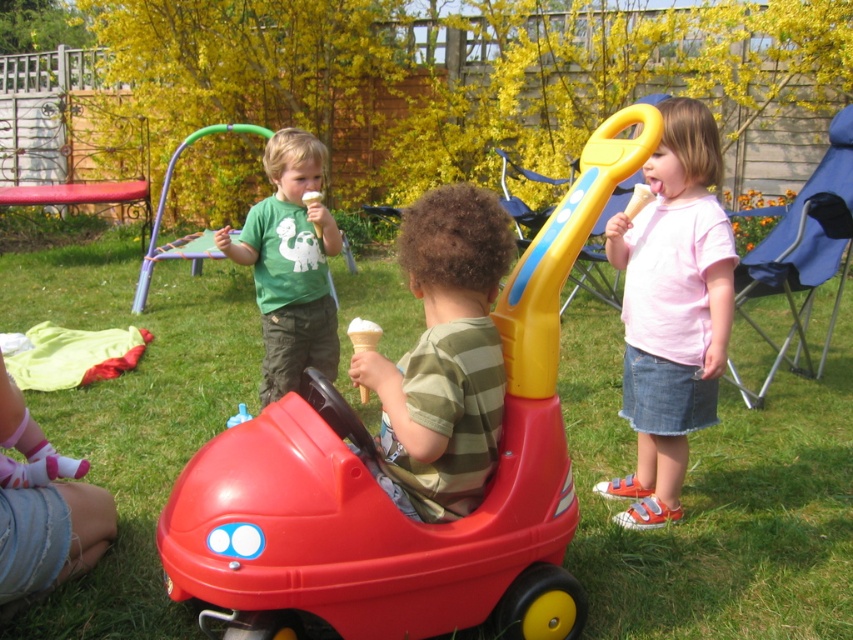
Question: Which object is farther from the camera taking this photo?

Choices:
 (A) red plastic toy car at center
 (B) striped cotton shirt at center
 (C) pink cotton shirt at upper right
 (D) vanilla ice cream in waffle cone at center

Answer: (C)

Question: Does red plastic toy car at center appear under striped cotton shirt at center?

Choices:
 (A) yes
 (B) no

Answer: (A)

Question: Is striped cotton shirt at center further to the viewer compared to matte green t-shirt at upper center?

Choices:
 (A) no
 (B) yes

Answer: (A)

Question: Which point is farther to the camera?

Choices:
 (A) vanilla ice cream in waffle cone at center
 (B) striped cotton shirt at center

Answer: (A)

Question: Considering the relative positions of red plastic toy car at center and pink cotton shirt at upper right in the image provided, where is red plastic toy car at center located with respect to pink cotton shirt at upper right?

Choices:
 (A) right
 (B) left

Answer: (B)

Question: Estimate the real-world distances between objects in this image. Which object is closer to the vanilla ice cream in waffle cone at center?

Choices:
 (A) striped cotton shirt at center
 (B) matte green t-shirt at upper center

Answer: (A)